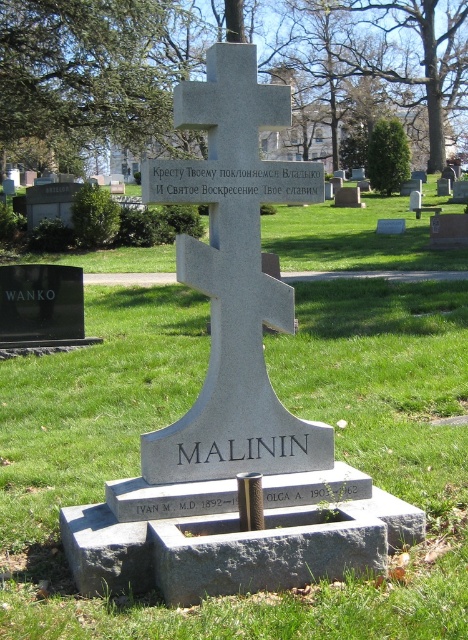
Question: Can you confirm if green grass at center is positioned to the right of gray stone cross at center?

Choices:
 (A) yes
 (B) no

Answer: (B)

Question: Which point is closer to the camera taking this photo?

Choices:
 (A) click(x=417, y=266)
 (B) click(x=255, y=116)

Answer: (B)

Question: Which of the following is the closest to the observer?

Choices:
 (A) (273, 460)
 (B) (337, 305)

Answer: (A)

Question: Is green grass at center wider than gray stone cross at center?

Choices:
 (A) yes
 (B) no

Answer: (A)

Question: Among these objects, which one is nearest to the camera?

Choices:
 (A) green grass at center
 (B) gray stone cross at center

Answer: (A)

Question: Does green grass at center appear on the right side of gray stone cross at center?

Choices:
 (A) no
 (B) yes

Answer: (A)